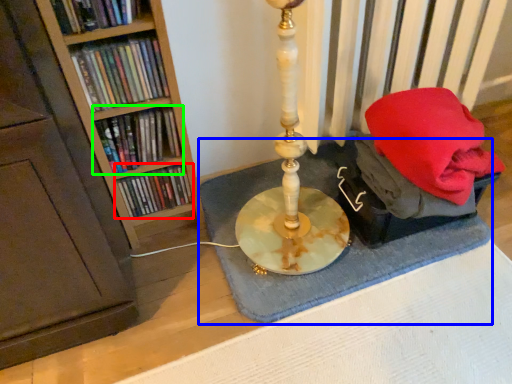
Question: Estimate the real-world distances between objects in this image. Which object is farther from book (highlighted by a red box), bath mat (highlighted by a blue box) or book (highlighted by a green box)?

Choices:
 (A) bath mat
 (B) book

Answer: (A)